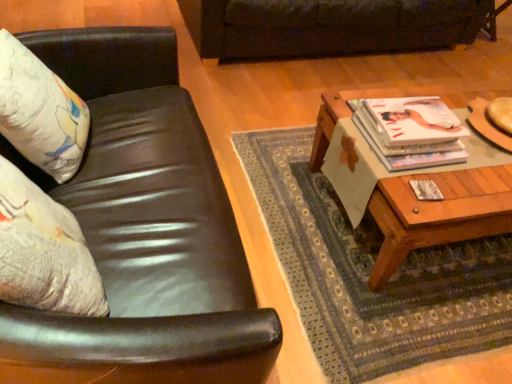
The width and height of the screenshot is (512, 384). Find the location of `free space to the left of woodenwoodencoffee table at right`. free space to the left of woodenwoodencoffee table at right is located at coordinates (274, 173).